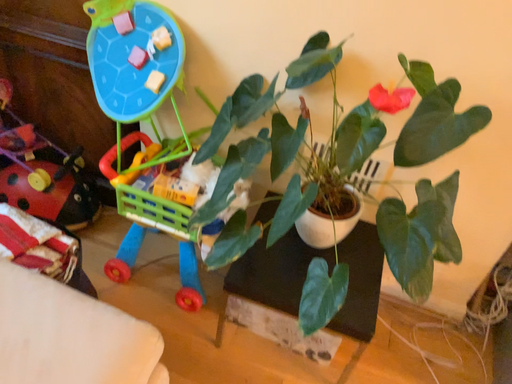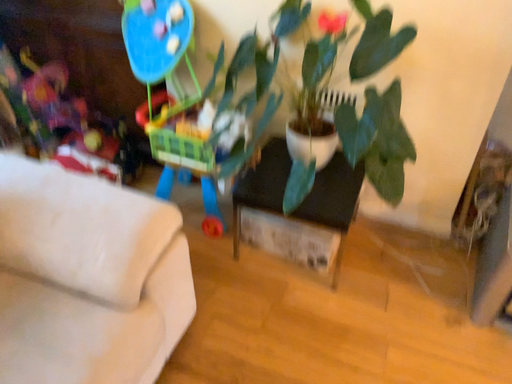
Question: How did the camera likely rotate when shooting the video?

Choices:
 (A) rotated right
 (B) rotated left

Answer: (B)